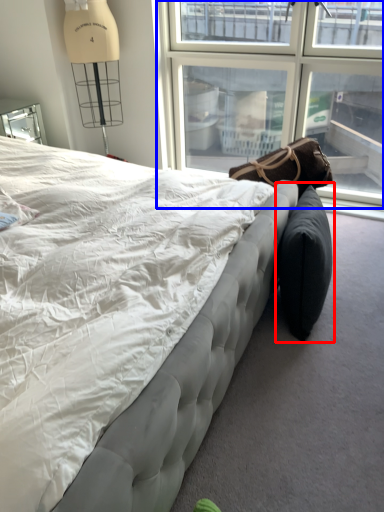
Question: Which object is further to the camera taking this photo, bean bag chair (highlighted by a red box) or window (highlighted by a blue box)?

Choices:
 (A) bean bag chair
 (B) window

Answer: (B)